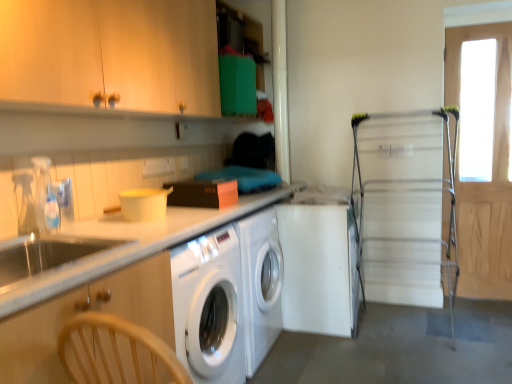
At what (x,y) coordinates should I click in order to perform the action: click on free space in front of wooden screen door at right, which is the first screen door in right-to-left order. Please return your answer as a coordinate pair (x, y). Looking at the image, I should click on (486, 309).